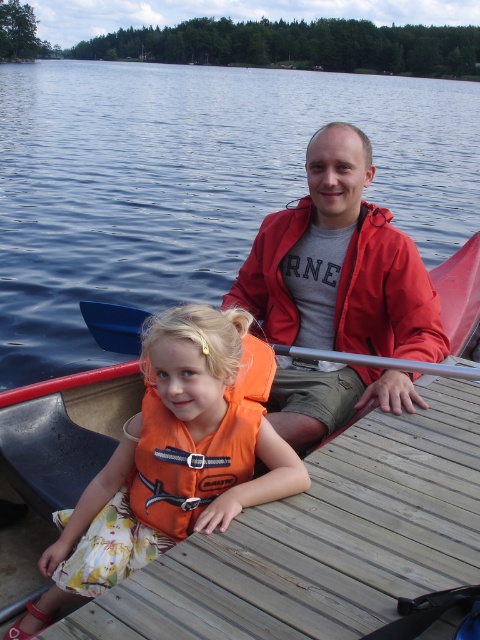
You are a photographer planning to take a photo of the blue water at center and the smooth plastic paddle at center. Which object should you focus on if you want the larger object to be in sharp focus?

The blue water at center is larger than the smooth plastic paddle at center, so you should focus on the blue water at center to ensure it is in sharp focus.

You are a photographer planning to take a photo of the blue water at center and the smooth plastic paddle at center. Which object should you focus on if you want to capture the one that appears larger in the frame?

The blue water at center appears larger in the frame because it is much taller than the smooth plastic paddle at center.